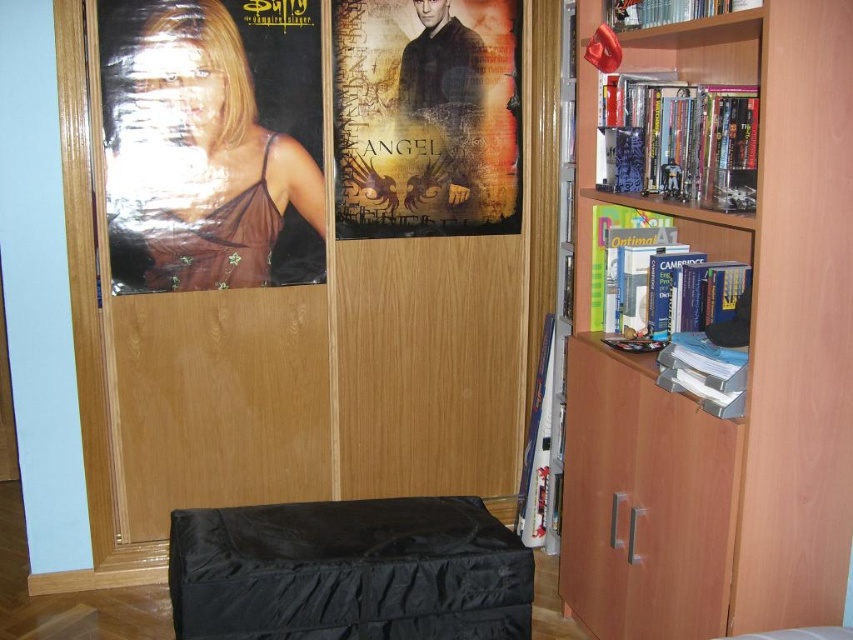
Question: Among these objects, which one is farthest from the camera?

Choices:
 (A) textured paper poster at center
 (B) wooden bookshelf at upper right
 (C) light brown wood bookshelf at right

Answer: (A)

Question: Observing the image, what is the correct spatial positioning of textured paper poster at center in reference to wooden bookshelf at upper right?

Choices:
 (A) above
 (B) below

Answer: (A)

Question: Estimate the real-world distances between objects in this image. Which object is closer to the black fabric stool at lower center?

Choices:
 (A) wooden bookshelf at upper right
 (B) textured paper poster at center
 (C) light brown wood bookshelf at right
 (D) matte black poster at left

Answer: (C)

Question: Does matte black poster at left have a larger size compared to wooden bookshelf at upper right?

Choices:
 (A) yes
 (B) no

Answer: (A)

Question: Among these points, which one is nearest to the camera?

Choices:
 (A) 772,589
 (B) 677,108
 (C) 480,141

Answer: (A)

Question: Is light brown wood bookshelf at right to the left of matte black poster at left from the viewer's perspective?

Choices:
 (A) yes
 (B) no

Answer: (B)